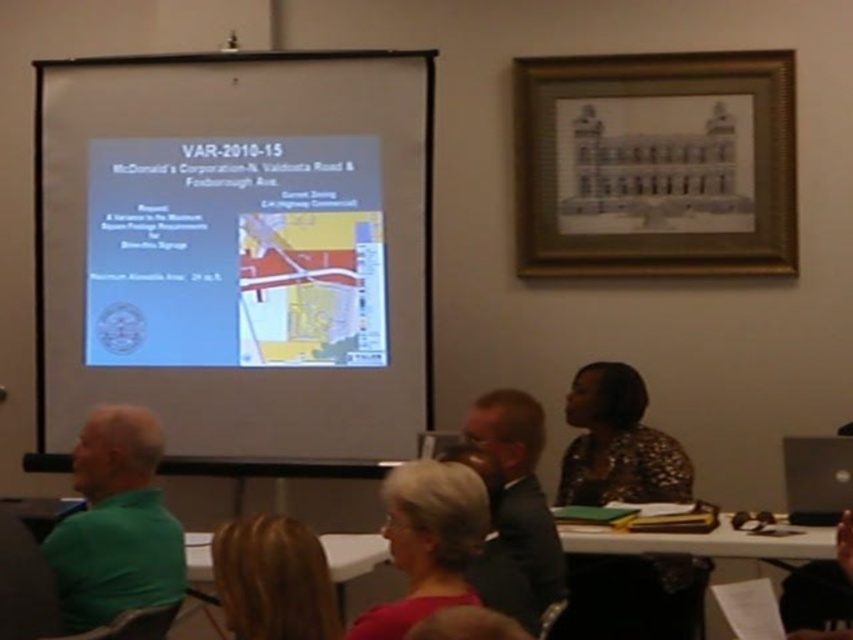
You are standing in the meeting room and want to reach the point marked at coordinates point (55, 93). If you walk straight ahead, how far will you have to walk to reach that point?

The distance between you and point (55, 93) is 4.21 meters, so you will have to walk 4.21 meters straight ahead to reach it.

You are standing in the room where the meeting is taking place. You need to present a 1.5 meter wide poster. Is there enough space to hang it on the white matte projection screen at upper center without overlapping any existing content?

The white matte projection screen at upper center is 3.93 meters away from the viewer. However, the question of space for a 1.5 meter wide poster depends on the screen size, which isn not provided in the description. Therefore, it cannot be determined if there is enough space.

From the picture: You are a person standing at the location of the blonde hair at lower center. You want to project a presentation onto the matte white projector screen at upper center. Can you reach the screen from your current position without moving your feet?

The matte white projector screen at upper center is 7.15 feet away from blonde hair at lower center. Since the average arm length is about 2.5 feet, you cannot reach the matte white projector screen at upper center from your current position without moving your feet.